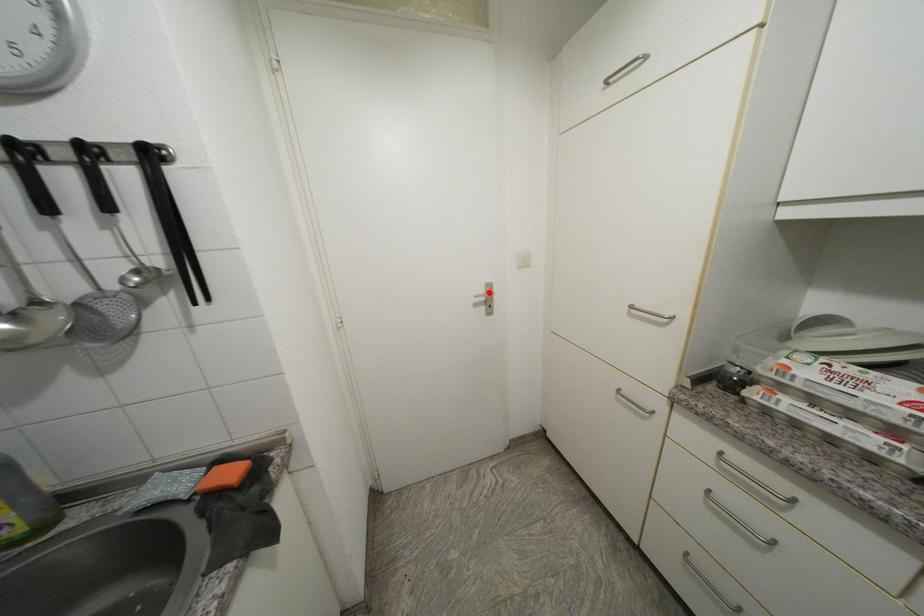
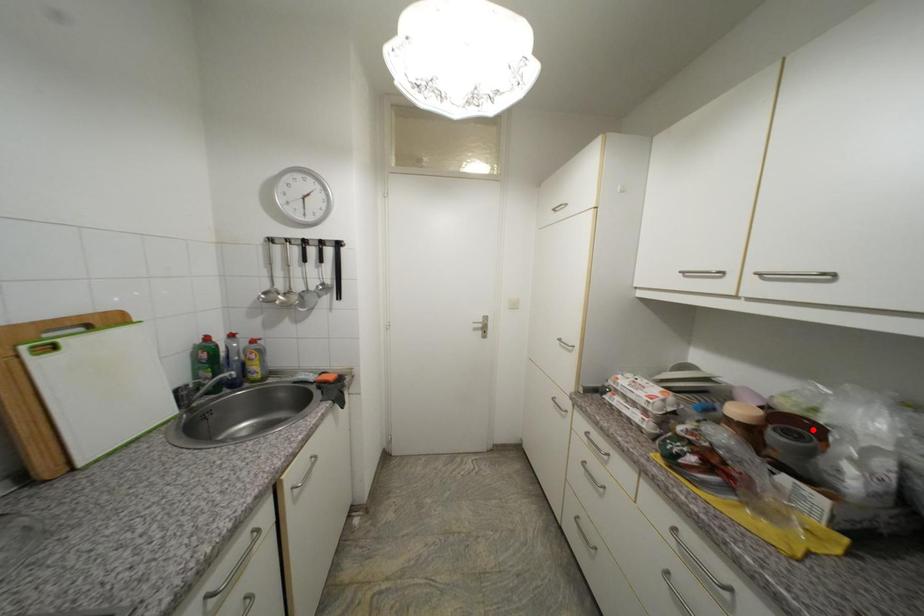
I am providing you with two images of the same scene from different viewpoints. A red point is marked on the first image and another point is marked on the second image. Is the marked point in image1 the same physical position as the marked point in image2?

No